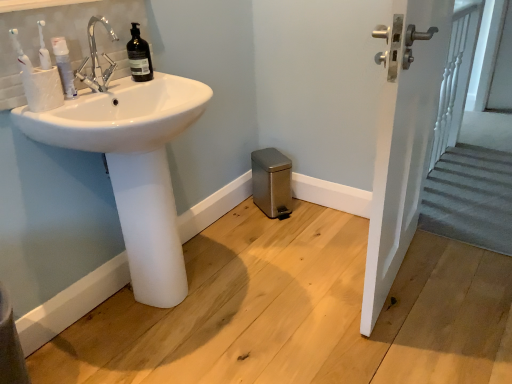
Locate an element on the screen. The height and width of the screenshot is (384, 512). vacant space in between white glossy door handle at upper right and satin silver trash can at lower center is located at coordinates (322, 244).